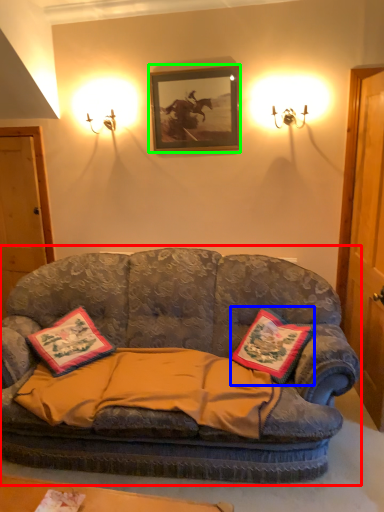
Question: Which is nearer to the studio couch (highlighted by a red box)? pillow (highlighted by a blue box) or picture frame (highlighted by a green box).

Choices:
 (A) pillow
 (B) picture frame

Answer: (A)